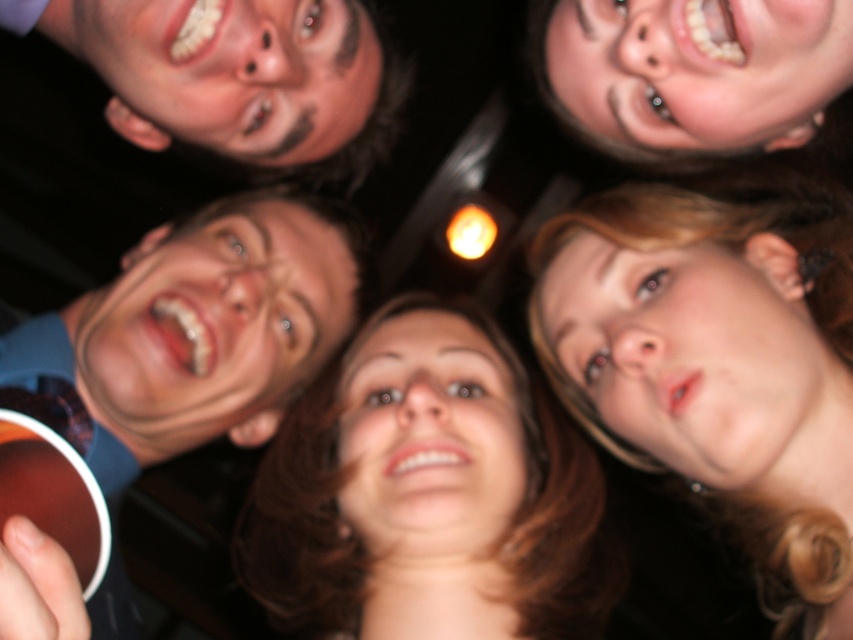
Is blue fabric shirt at upper left thinner than smooth skin face at upper right?

No.

From the picture: Is the position of blue fabric shirt at upper left more distant than that of smooth skin face at upper right?

Yes.

I want to click on blue fabric shirt at upper left, so click(x=194, y=332).

Which is in front, point (312, 481) or point (631, 96)?

Point (631, 96)

Is smooth brown hair at center above smooth skin face at upper right?

Incorrect, smooth brown hair at center is not positioned above smooth skin face at upper right.

Who is more forward, [538,536] or [741,4]?

Point [741,4]

Locate an element on the screen. This screenshot has height=640, width=853. smooth brown hair at center is located at coordinates (428, 493).

Is smooth brown hair at center below blue fabric shirt at upper left?

Yes, smooth brown hair at center is below blue fabric shirt at upper left.

The height and width of the screenshot is (640, 853). Describe the element at coordinates (428, 493) in the screenshot. I see `smooth brown hair at center` at that location.

The image size is (853, 640). In order to click on smooth brown hair at center in this screenshot , I will do `click(428, 493)`.